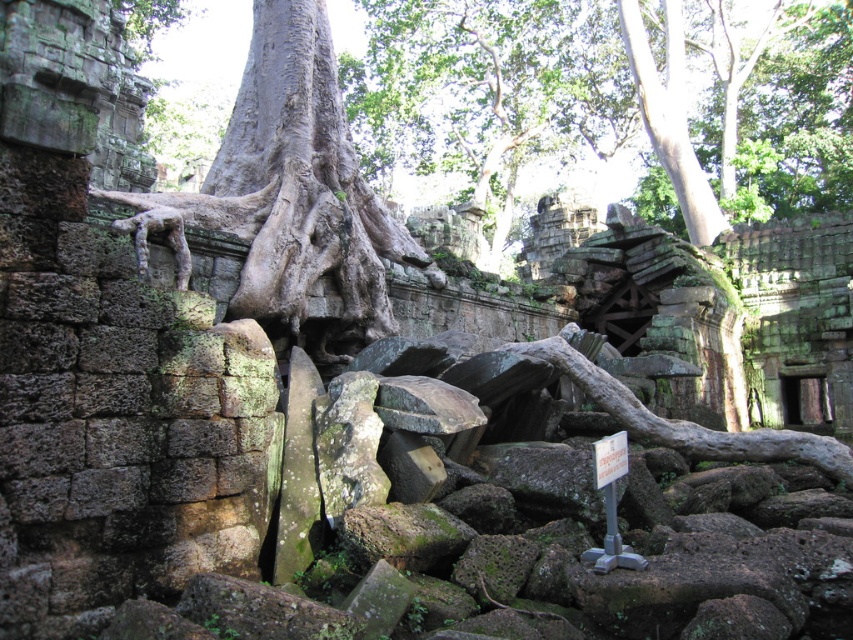
You are an archaeologist examining the ancient stone structure. You notice a specific point of interest at coordinates point (485,83). What object is located at this point?

The green mossy stone at upper center is located at point (485,83).

You are an archaeologist examining the ancient stone structure. You notice the gray rough stone tree trunk at center and the green mossy wood at center. Which object is positioned to the right side of the other?

The gray rough stone tree trunk at center is to the left of green mossy wood at center, so the green mossy wood at center is positioned to the right of the gray rough stone tree trunk at center.